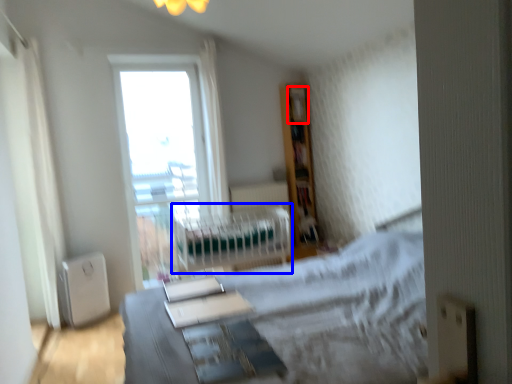
Question: Which object is further to the camera taking this photo, shelf (highlighted by a red box) or hospital bed (highlighted by a blue box)?

Choices:
 (A) shelf
 (B) hospital bed

Answer: (A)